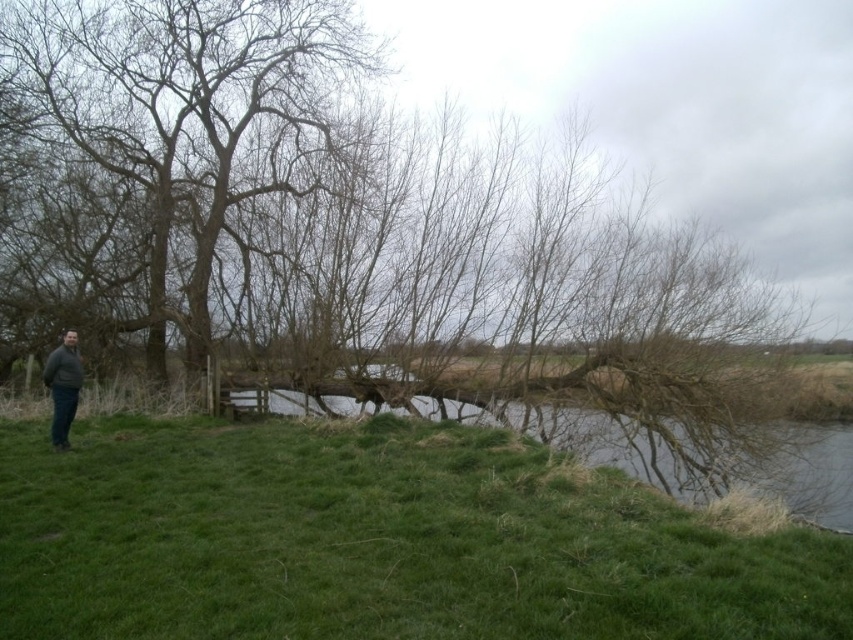
Does brown grassy river at center appear under dark gray sweater at lower left?

Yes.

Is point (827, 460) in front of point (61, 385)?

That is False.

The image size is (853, 640). Find the location of `brown grassy river at center`. brown grassy river at center is located at coordinates (578, 435).

Find the location of `brown grassy river at center`. brown grassy river at center is located at coordinates (578, 435).

Is green grassy at lower left smaller than dark gray sweater at lower left?

No, green grassy at lower left is not smaller than dark gray sweater at lower left.

Who is higher up, green grassy at lower left or dark gray sweater at lower left?

dark gray sweater at lower left

Find the location of `green grassy at lower left`. green grassy at lower left is located at coordinates tap(376, 541).

Image resolution: width=853 pixels, height=640 pixels. Identify the location of green grassy at lower left. (376, 541).

Who is shorter, bare wood tree at left or dark gray sweater at lower left?

bare wood tree at left is shorter.

Does bare wood tree at left have a smaller size compared to dark gray sweater at lower left?

Yes, bare wood tree at left is smaller than dark gray sweater at lower left.

Is point (122, 68) positioned before point (53, 404)?

No, it is not.

Where is `bare wood tree at left`? Image resolution: width=853 pixels, height=640 pixels. bare wood tree at left is located at coordinates (192, 115).